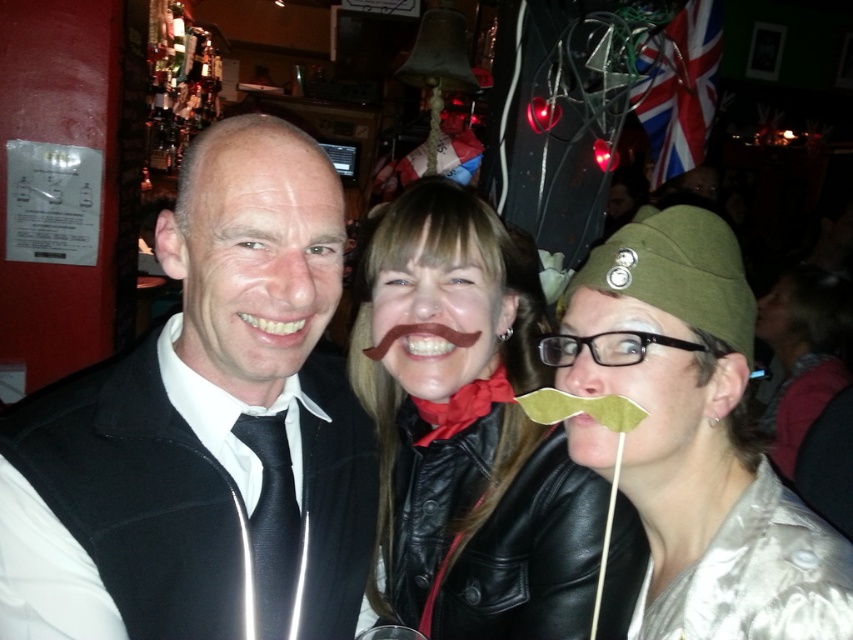
Question: Which of these objects is positioned farthest from the red satin bow tie at center?

Choices:
 (A) silky silver dress at lower right
 (B) black matte suit at left

Answer: (A)

Question: Does silvery metallic hat at right come behind red satin bow tie at center?

Choices:
 (A) yes
 (B) no

Answer: (B)

Question: Which point is farther from the camera taking this photo?

Choices:
 (A) (186, 163)
 (B) (793, 608)
 (C) (450, 426)

Answer: (C)

Question: Does silky silver dress at lower right appear on the left side of red satin bow tie at center?

Choices:
 (A) yes
 (B) no

Answer: (B)

Question: Which object is closer to the camera taking this photo?

Choices:
 (A) silvery metallic hat at right
 (B) black matte suit at left
 (C) red satin bow tie at center
 (D) brown leather jacket at center

Answer: (A)

Question: Does black matte suit at left appear on the right side of red satin bow tie at center?

Choices:
 (A) no
 (B) yes

Answer: (A)